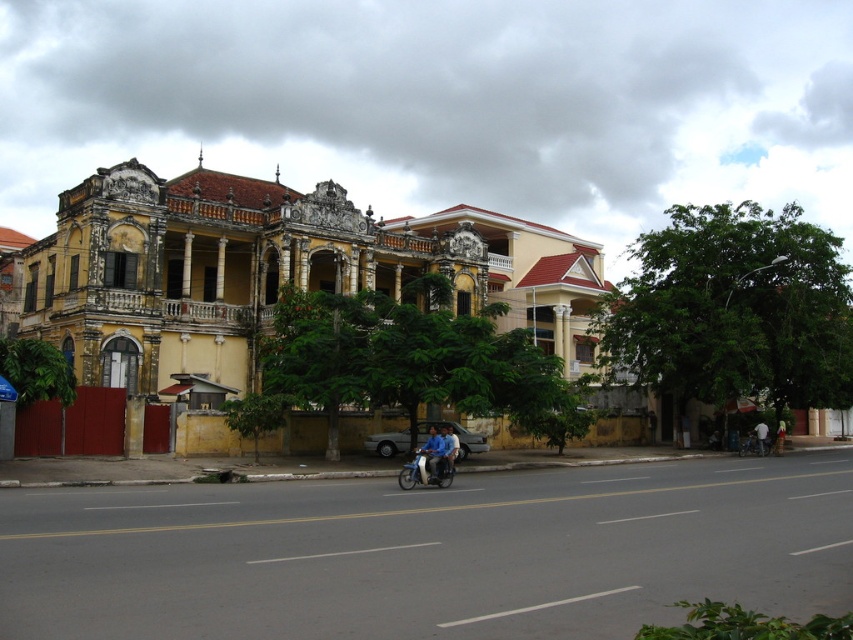
Question: Which object is positioned farthest from the blue metallic motorcycle at center?

Choices:
 (A) blue fabric shirt at center
 (B) light blue shirt at center
 (C) blue fabric person at center
 (D) metallic silver bicycle at lower right

Answer: (B)

Question: Is blue fabric shirt at center behind blue fabric person at center?

Choices:
 (A) yes
 (B) no

Answer: (B)

Question: Can you confirm if blue metallic motorcycle at center is positioned to the left of blue fabric shirt at center?

Choices:
 (A) yes
 (B) no

Answer: (A)

Question: From the image, what is the correct spatial relationship of blue metallic motorcycle at center in relation to blue fabric person at center?

Choices:
 (A) left
 (B) right

Answer: (A)

Question: Which of the following is the closest to the observer?

Choices:
 (A) (421, 460)
 (B) (761, 440)

Answer: (A)

Question: Which object is positioned farthest from the blue fabric person at center?

Choices:
 (A) blue metallic motorcycle at center
 (B) blue fabric shirt at center
 (C) metallic silver bicycle at lower right
 (D) light blue shirt at center

Answer: (D)